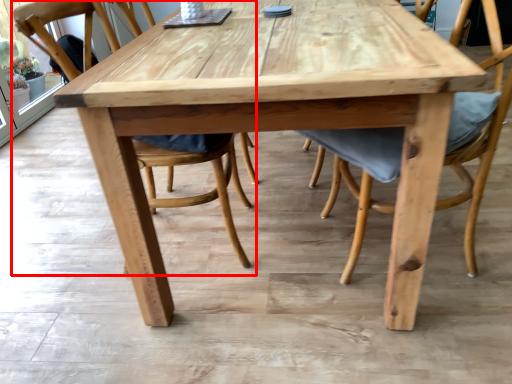
Question: From the image's perspective, considering the relative positions of chair (annotated by the red box) and chair in the image provided, where is chair (annotated by the red box) located with respect to the staircase?

Choices:
 (A) below
 (B) above

Answer: (B)